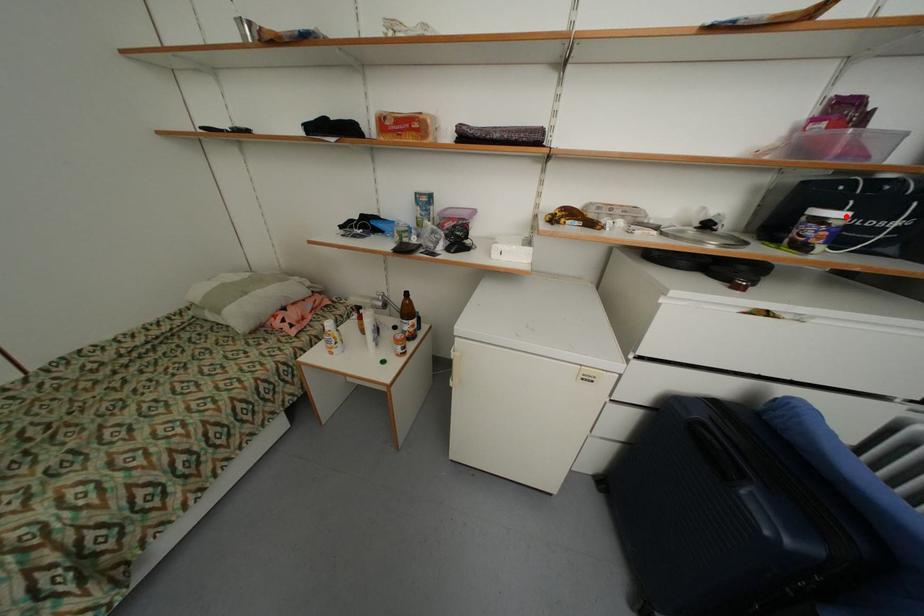
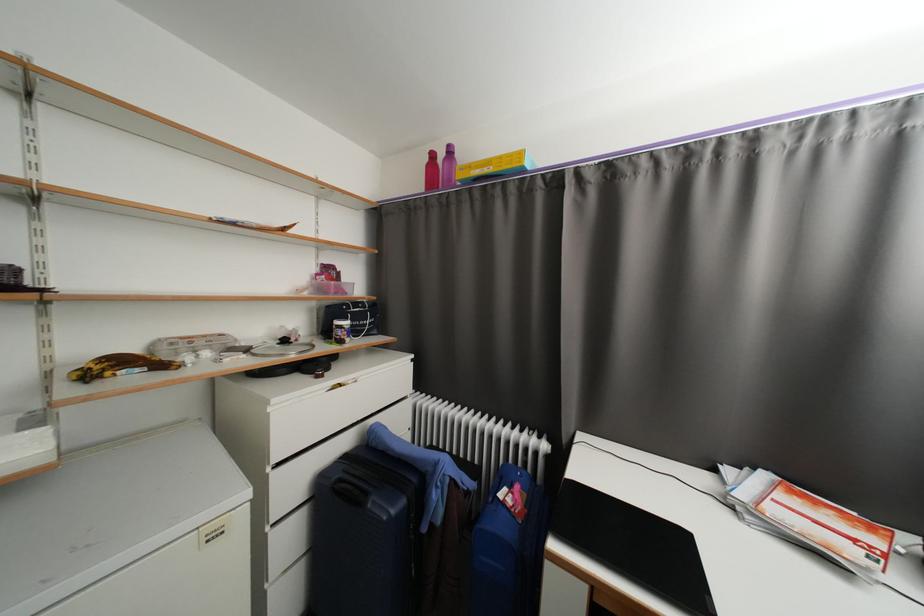
Locate, in the second image, the point that corresponds to the highlighted location in the first image.

(353, 323)